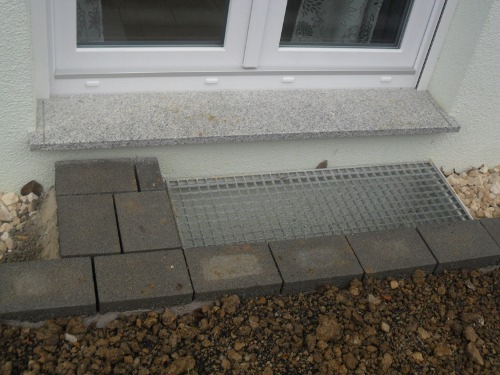
The image size is (500, 375). Identify the location of glass panes. (166, 29), (324, 29).